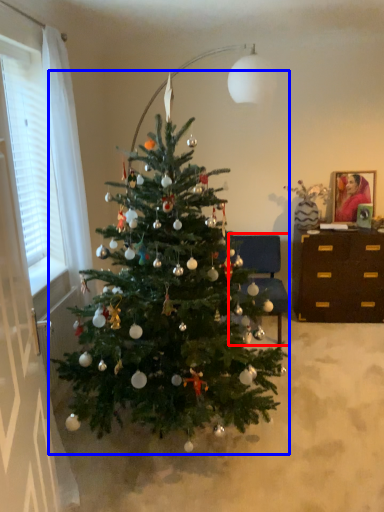
Question: Which object is closer to the camera taking this photo, armchair (highlighted by a red box) or christmas tree (highlighted by a blue box)?

Choices:
 (A) armchair
 (B) christmas tree

Answer: (B)